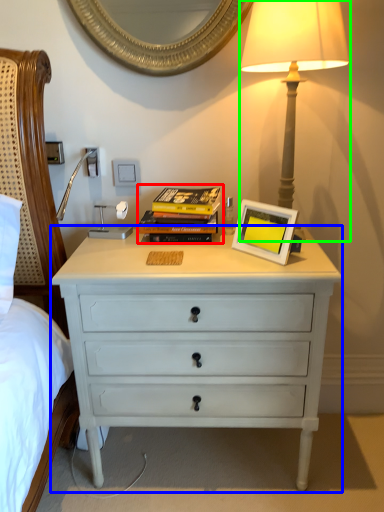
Question: Which object is positioned closest to magazine (highlighted by a red box)? Select from chest of drawers (highlighted by a blue box) and bedside lamp (highlighted by a green box).

Choices:
 (A) chest of drawers
 (B) bedside lamp

Answer: (A)